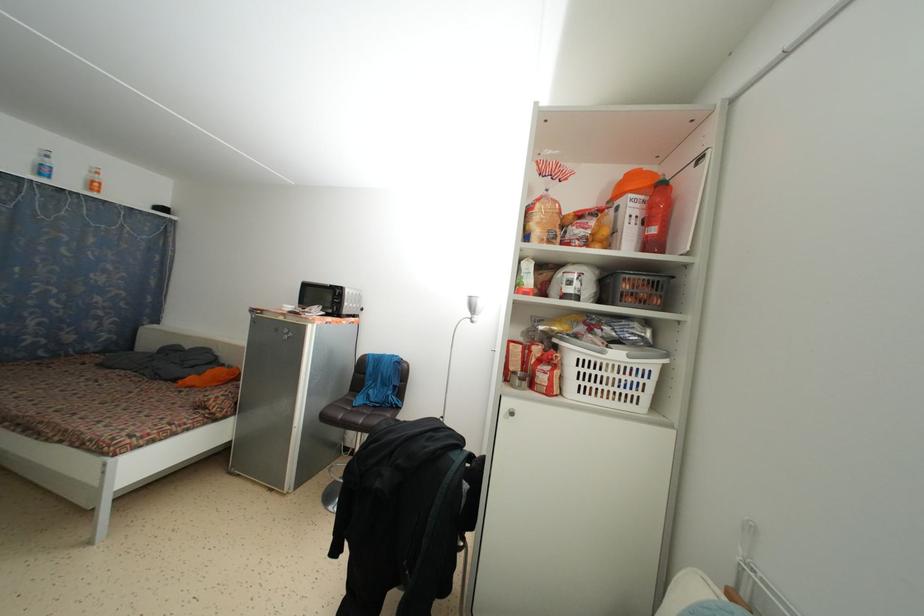
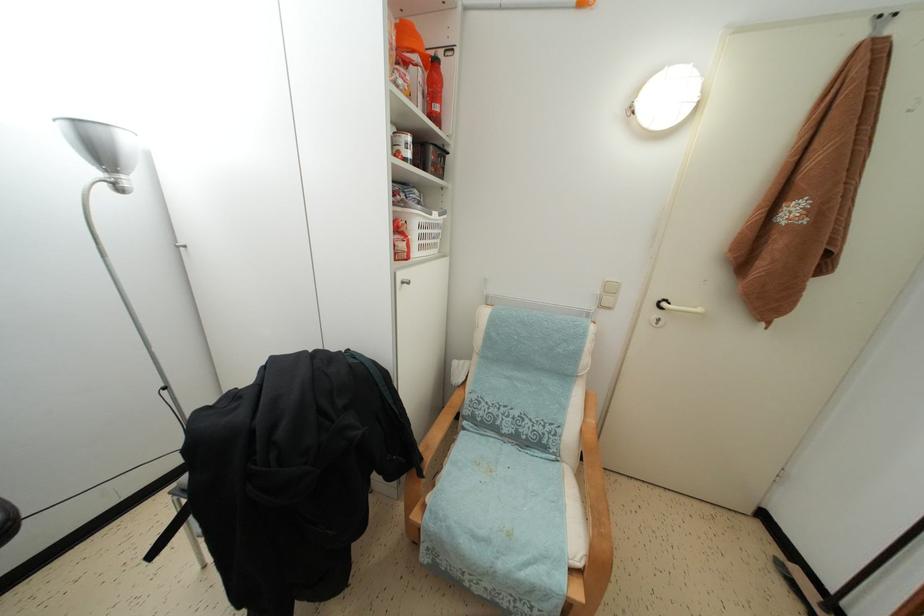
How did the camera likely rotate?

The camera's rotation is toward right-down.